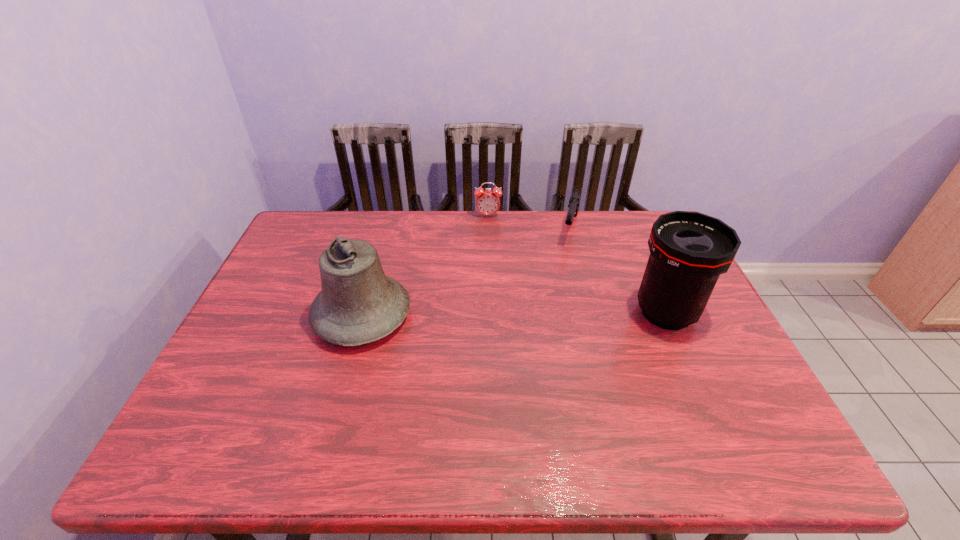
Identify the location of free space on the desktop that is between the leftmost object and the telephoto lens and is positioned on the face of the alarm clock. (495, 314).

Find the location of a particular element. This screenshot has height=540, width=960. free space on the desktop that is between the bell and the rightmost object and is positioned at the end of the barrel of the gun is located at coordinates (547, 314).